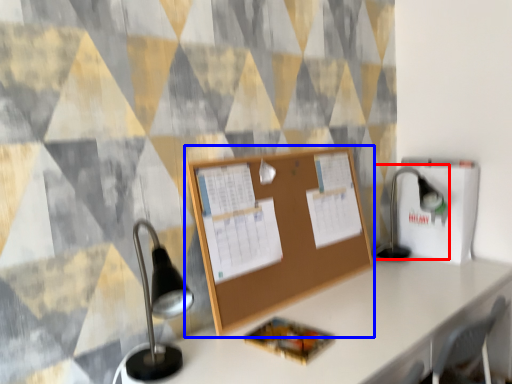
Question: Which point is further to the camera, table lamp (highlighted by a red box) or bulletin board (highlighted by a blue box)?

Choices:
 (A) table lamp
 (B) bulletin board

Answer: (A)